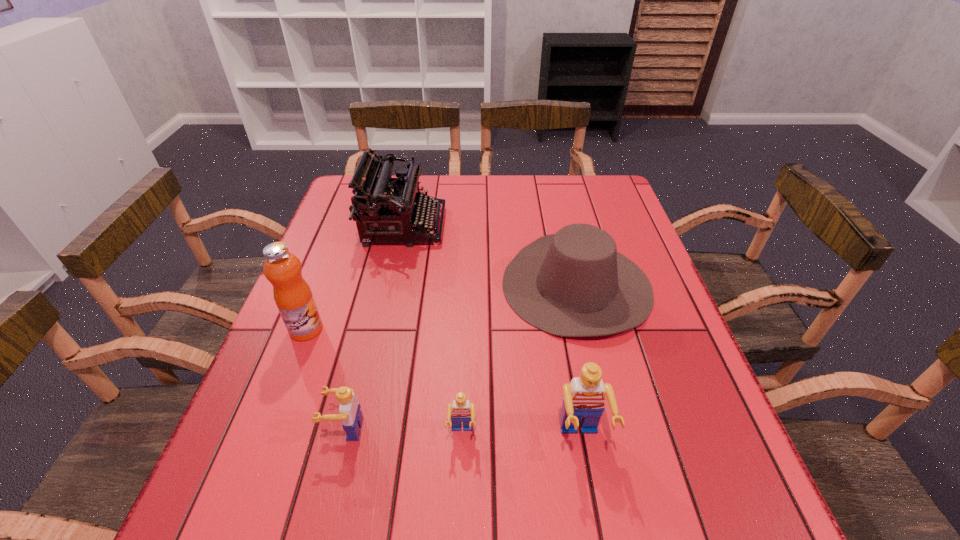
The image size is (960, 540). In order to click on free location at the left edge of the desktop in this screenshot , I will do `click(339, 304)`.

This screenshot has height=540, width=960. I want to click on vacant space at the right edge, so click(639, 406).

This screenshot has width=960, height=540. In the image, there is a desktop. In order to click on free region at the far right corner in this screenshot , I will do `click(580, 212)`.

Where is `free space between the tallest object and the leftmost Lego`? The width and height of the screenshot is (960, 540). free space between the tallest object and the leftmost Lego is located at coordinates (325, 379).

The height and width of the screenshot is (540, 960). What are the coordinates of `free space between the second tallest Lego and the cowboy hat` in the screenshot? It's located at (461, 357).

You are a GUI agent. You are given a task and a screenshot of the screen. Output one action in this format:
    pyautogui.click(x=<x>, y=<y>)
    Task: Click on the vacant region between the third object from right to left and the leftmost Lego
    This screenshot has height=540, width=960.
    Given the screenshot: What is the action you would take?
    pyautogui.click(x=404, y=431)

Where is `blank region between the leftmost Lego and the cowboy hat`? blank region between the leftmost Lego and the cowboy hat is located at coordinates (461, 357).

The width and height of the screenshot is (960, 540). I want to click on vacant area that lies between the leftmost Lego and the fruit juice, so click(x=325, y=379).

Identify the location of vacant region between the typewriter and the cowboy hat. Image resolution: width=960 pixels, height=540 pixels. (490, 255).

Image resolution: width=960 pixels, height=540 pixels. Identify the location of vacant region between the shortest object and the leftmost object. (384, 381).